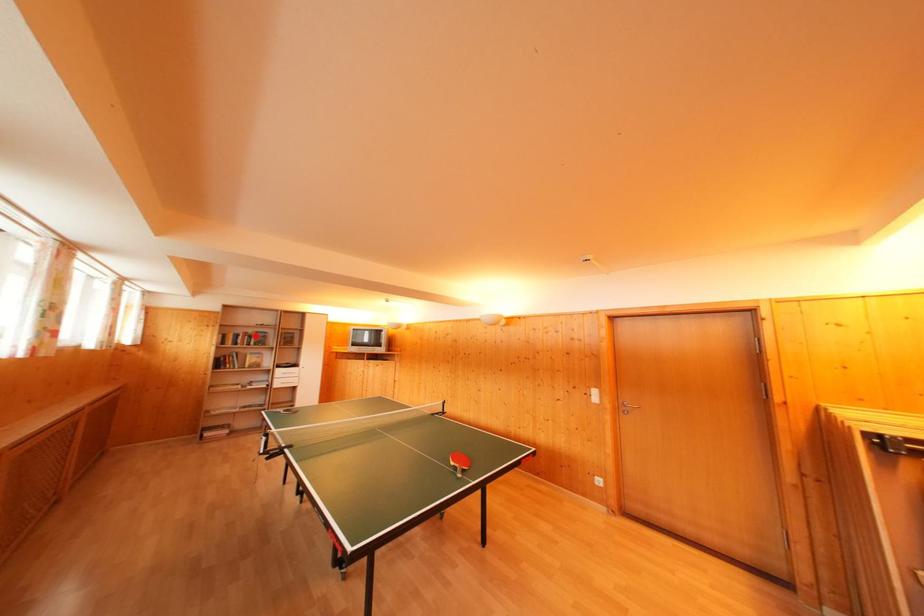
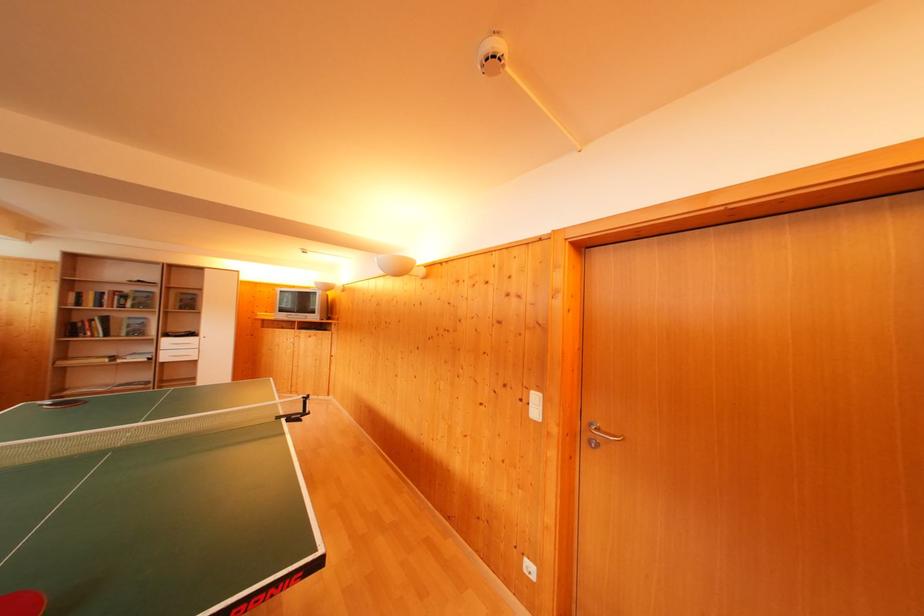
In the second image, find the point that corresponds to the highlighted location in the first image.

(131, 294)